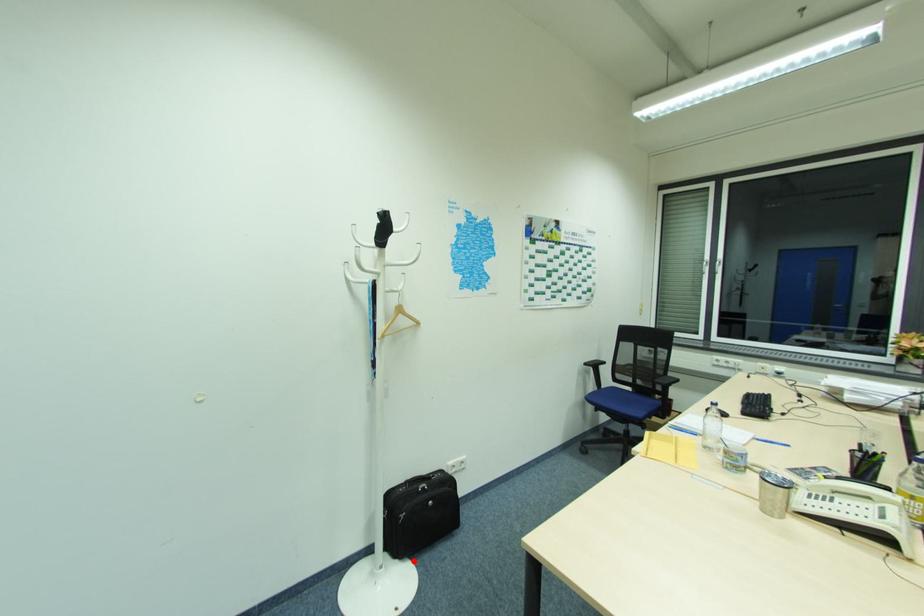
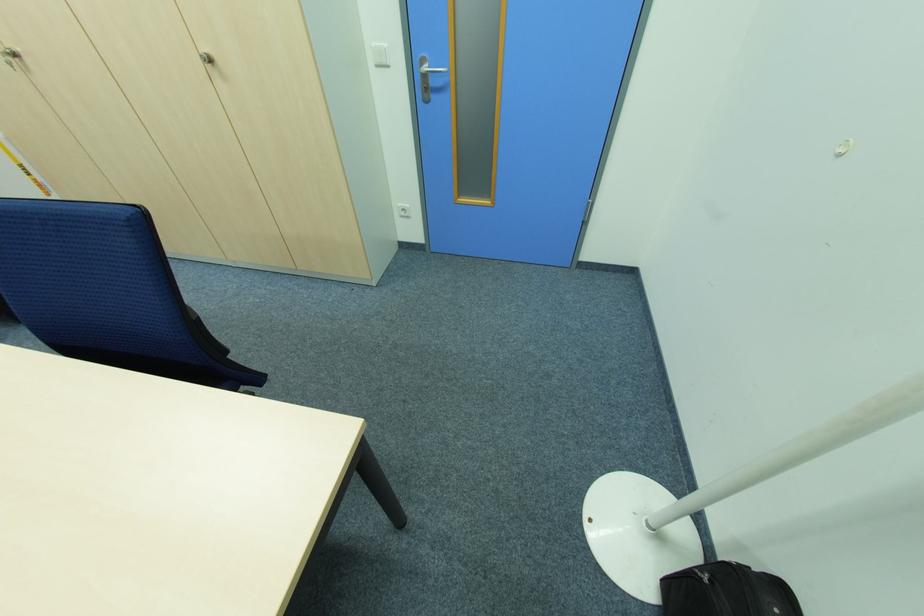
Where in the second image is the point corresponding to the highlighted location from the first image?

(662, 607)